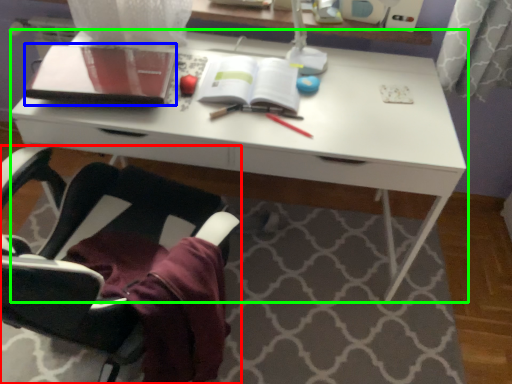
Question: Which is farther away from chair (highlighted by a red box)? notebook (highlighted by a blue box) or desk (highlighted by a green box)?

Choices:
 (A) notebook
 (B) desk

Answer: (A)